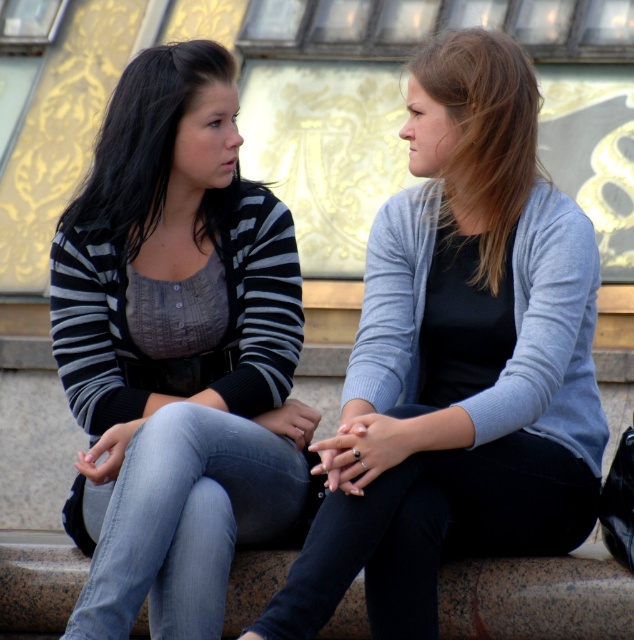
Who is lower down, matte gray cardigan at center or striped knit sweater at left?

striped knit sweater at left is below.

Can you confirm if matte gray cardigan at center is positioned to the right of striped knit sweater at left?

Indeed, matte gray cardigan at center is positioned on the right side of striped knit sweater at left.

Between point (482, 131) and point (216, 205), which one is positioned behind?

The point (216, 205) is more distant.

Image resolution: width=634 pixels, height=640 pixels. I want to click on matte gray cardigan at center, so click(x=482, y=136).

Who is positioned more to the right, light blue sweater at center or matte gray cardigan at center?

From the viewer's perspective, matte gray cardigan at center appears more on the right side.

Can you confirm if light blue sweater at center is taller than matte gray cardigan at center?

Indeed, light blue sweater at center has a greater height compared to matte gray cardigan at center.

Does point (598, 460) come closer to viewer compared to point (456, 42)?

No.

Locate an element on the screen. light blue sweater at center is located at coordinates (458, 362).

Who is higher up, matte black sweater at left or matte gray cardigan at center?

matte gray cardigan at center is above.

Does matte black sweater at left have a greater width compared to matte gray cardigan at center?

Indeed, matte black sweater at left has a greater width compared to matte gray cardigan at center.

Is point (197, 92) more distant than point (493, 253)?

Yes, it is.

Locate an element on the screen. matte black sweater at left is located at coordinates (176, 352).